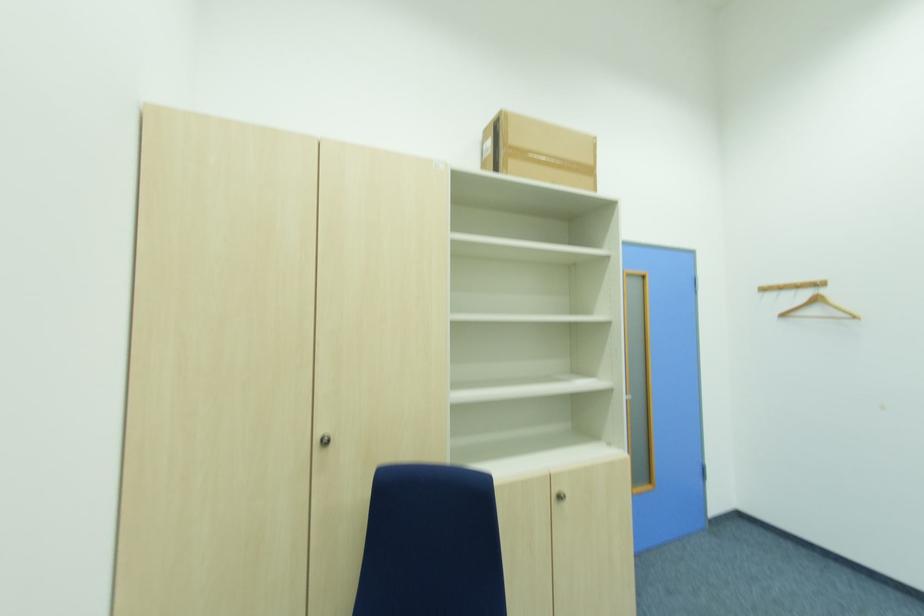
Describe the element at coordinates (641, 416) in the screenshot. The width and height of the screenshot is (924, 616). I see `the blue door handle` at that location.